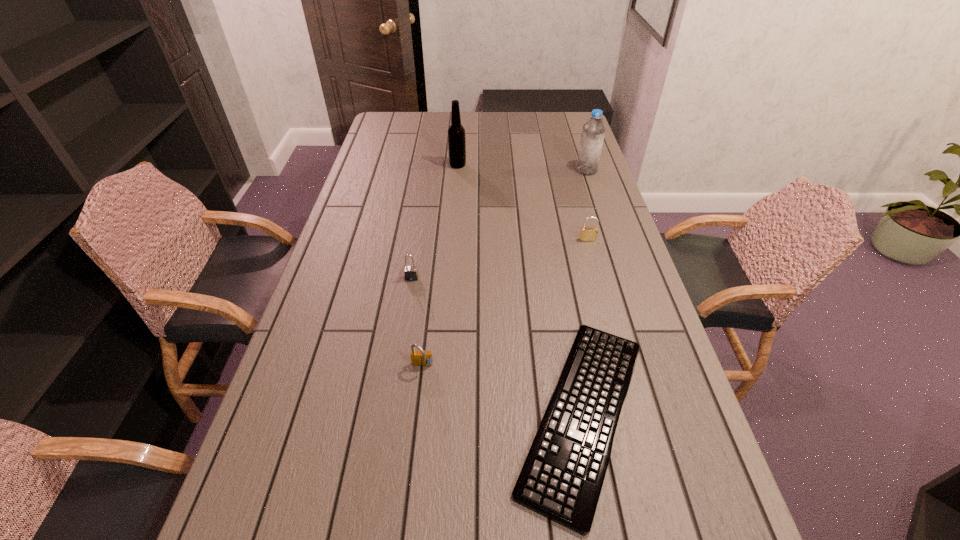
Where is `vacant area at the far left corner of the desktop`? The image size is (960, 540). vacant area at the far left corner of the desktop is located at coordinates pyautogui.click(x=403, y=133).

Find the location of a particular element. free space at the far right corner is located at coordinates (574, 128).

You are a GUI agent. You are given a task and a screenshot of the screen. Output one action in this format:
    pyautogui.click(x=<x>, y=<y>)
    Task: Click on the free space between the fourth farthest object and the nearest padlock
    This screenshot has height=540, width=960.
    Given the screenshot: What is the action you would take?
    pyautogui.click(x=418, y=322)

Identify the location of free space between the water bottle and the second padlock from left to right. Image resolution: width=960 pixels, height=540 pixels. (505, 268).

What are the coordinates of `free space between the nearest padlock and the third farthest object` in the screenshot? It's located at (505, 303).

Find the location of a particular element. unoccupied area between the beer bottle and the water bottle is located at coordinates (522, 167).

I want to click on free spot between the water bottle and the nearest padlock, so click(x=505, y=268).

Find the location of a particular element. The height and width of the screenshot is (540, 960). free spot between the computer keyboard and the third nearest object is located at coordinates (497, 346).

Locate an element on the screen. unoccupied position between the farthest padlock and the water bottle is located at coordinates (587, 205).

Find the location of a particular element. free space that is in between the beer bottle and the shortest object is located at coordinates [x=520, y=289].